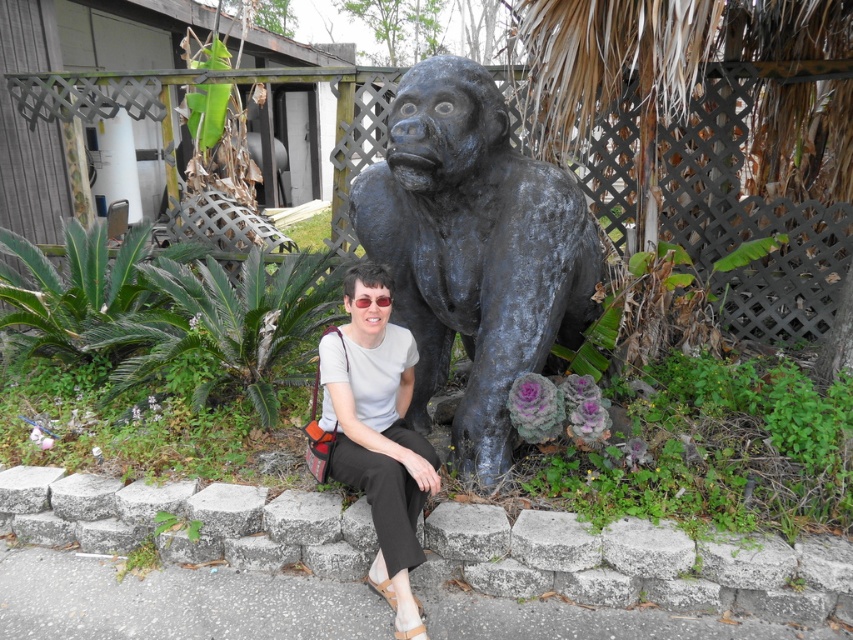
You are taking a photo of the woman and the gorilla statue. You want to focus on the woman first. Which point should you focus on first, point (459, 166) or point (383, 305)?

You should focus on point (459, 166) first because it is closer to the camera than point (383, 305).

You are standing in the park and want to place a small flower pot on the gray concrete curb at lower center. The coordinates for the curb are given as point [636,563]. If the flower pot has a diameter of 0.3 units, will it fit entirely on the curb?

The gray concrete curb at lower center is represented by point [636,563]. Since the flower pot has a diameter of 0.3 units and the curb is a single point, it cannot accommodate the pot. Please choose a larger area.

You are a photographer trying to capture a wide shot of the scene. Given that the gray concrete curb at lower center is smaller than the shiny black statue at center, which object should you focus on to ensure both are in frame without cropping?

You should focus on the shiny black statue at center since it takes up more space in the scene, ensuring both the gray concrete curb at lower center and the statue are included in the frame.